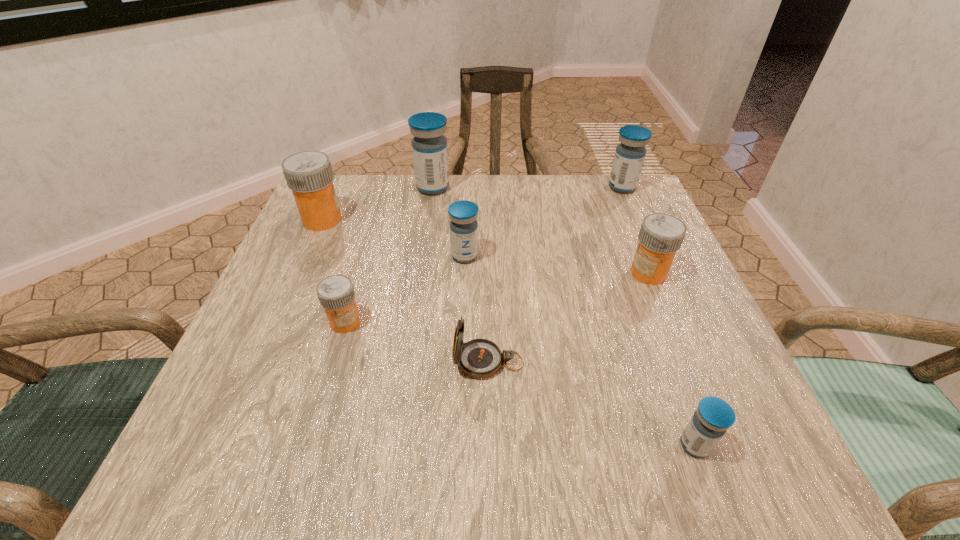
Where is `the leftmost blue medicine`? The width and height of the screenshot is (960, 540). the leftmost blue medicine is located at coordinates (429, 147).

Find the location of a particular element. The width and height of the screenshot is (960, 540). the tallest object is located at coordinates (429, 147).

The height and width of the screenshot is (540, 960). What are the coordinates of `the fifth nearest medicine` in the screenshot? It's located at (309, 174).

Find the location of `the sixth nearest object`. the sixth nearest object is located at coordinates tap(309, 174).

Where is `the third smallest blue medicine`? This screenshot has height=540, width=960. the third smallest blue medicine is located at coordinates (629, 157).

Find the location of a particular element. This screenshot has width=960, height=540. the rightmost orange medicine is located at coordinates (661, 235).

Locate an element on the screen. The width and height of the screenshot is (960, 540). the second nearest orange medicine is located at coordinates (661, 235).

Find the location of a particular element. This screenshot has width=960, height=540. the fourth medicine from right to left is located at coordinates (463, 225).

At what (x,y) coordinates should I click in order to perform the action: click on the second blue medicine from left to right. Please return your answer as a coordinate pair (x, y). Image resolution: width=960 pixels, height=540 pixels. Looking at the image, I should click on (463, 225).

At what (x,y) coordinates should I click in order to perform the action: click on the second nearest object. Please return your answer as a coordinate pair (x, y). Looking at the image, I should click on (479, 358).